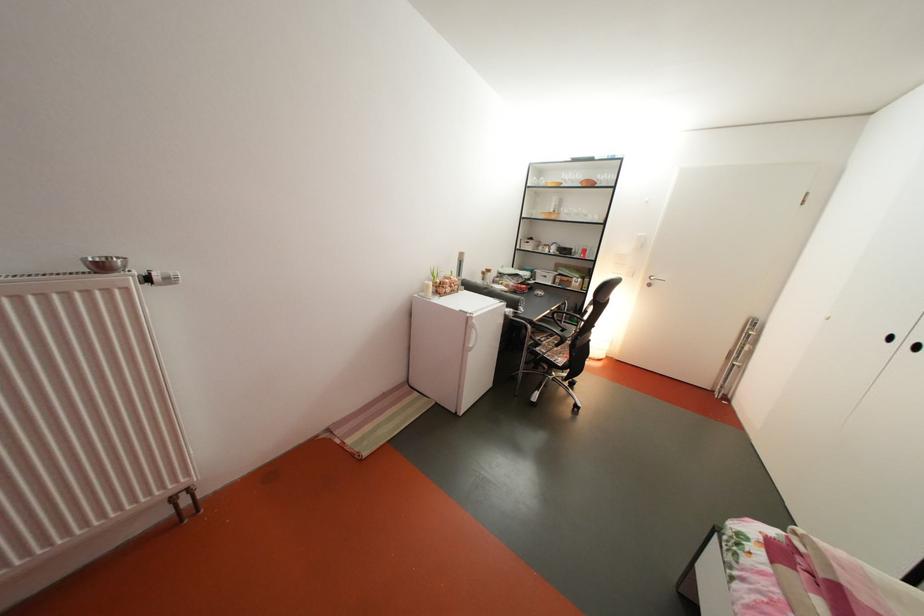
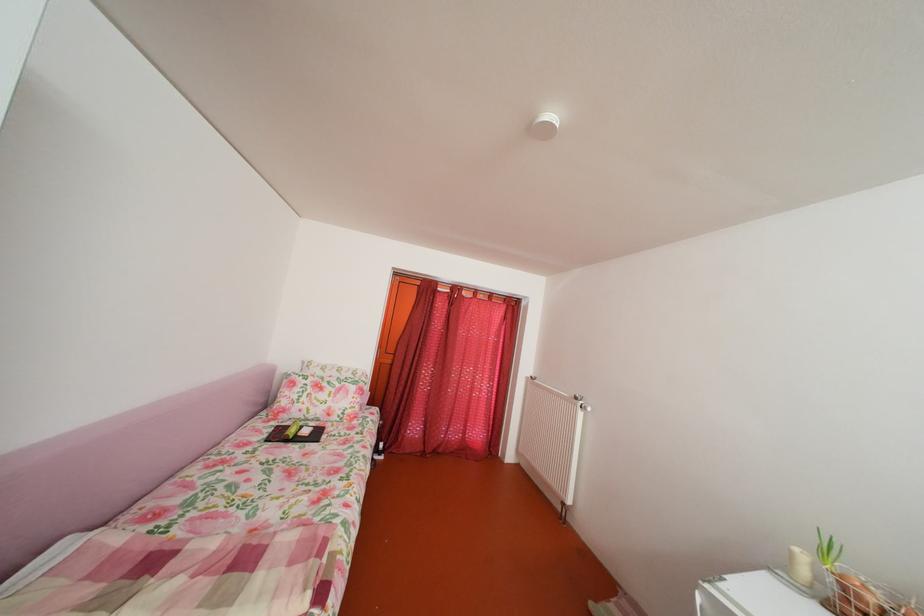
Where in the second image is the point corresponding to point 439,293 from the first image?

(803, 561)